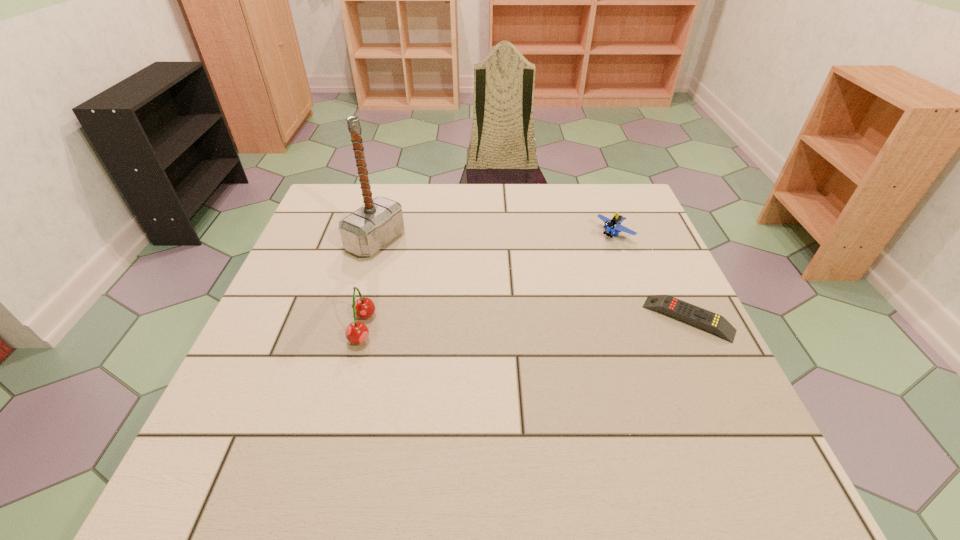
Where is `blank space located on the front-facing side of the second shortest object`? This screenshot has height=540, width=960. blank space located on the front-facing side of the second shortest object is located at coordinates (521, 299).

Locate an element on the screen. free region located 0.290m on the front-facing side of the second shortest object is located at coordinates (530, 293).

The image size is (960, 540). Identify the location of hammer that is at the far edge. (365, 231).

What are the coordinates of `Lego situated at the far edge` in the screenshot? It's located at (612, 225).

Where is `object that is at the left edge`? This screenshot has height=540, width=960. object that is at the left edge is located at coordinates (365, 231).

You are a GUI agent. You are given a task and a screenshot of the screen. Output one action in this format:
    pyautogui.click(x=<x>, y=<y>)
    Task: Click on the remote control situated at the right edge
    This screenshot has height=540, width=960.
    Given the screenshot: What is the action you would take?
    (700, 317)

Identify the location of Lego that is positioned at the right edge. Image resolution: width=960 pixels, height=540 pixels. (612, 225).

Identify the location of object present at the far left corner. (365, 231).

Find the location of a particular element. This screenshot has width=960, height=540. object present at the far right corner is located at coordinates (612, 225).

Where is `free space at the far edge of the desktop`? This screenshot has width=960, height=540. free space at the far edge of the desktop is located at coordinates (516, 218).